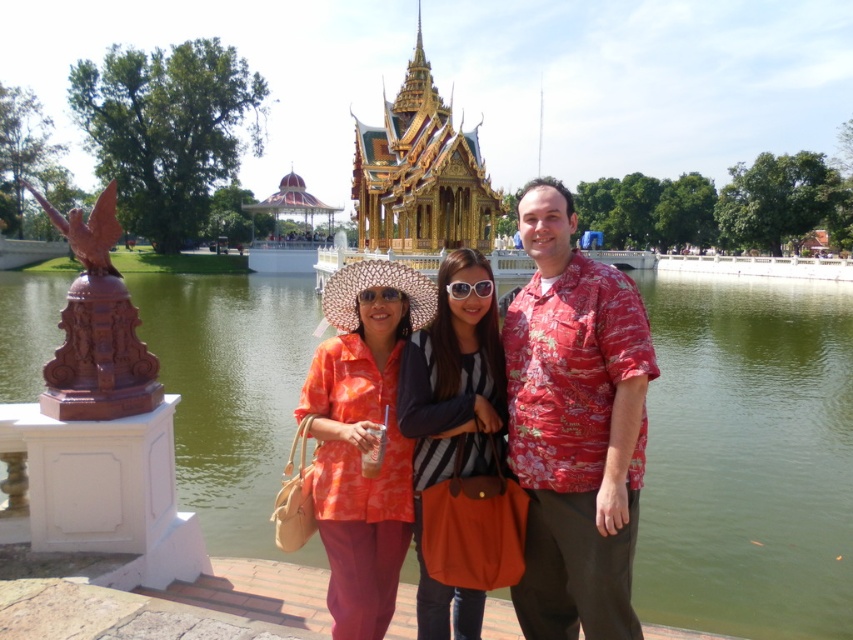
Which is more to the left, floral print shirt at center or matte black goggles at center?

Positioned to the left is matte black goggles at center.

Who is more forward, (601,381) or (384,298)?

Point (601,381)

Image resolution: width=853 pixels, height=640 pixels. I want to click on floral print shirt at center, so click(x=575, y=426).

Is orange printed shirt at center taller than striped fabric shirt at center?

No.

Is point (355, 620) farther from viewer compared to point (463, 637)?

No.

Identify the location of orange printed shirt at center. This screenshot has height=640, width=853. (363, 442).

Is matte orange shirt at center in front of floral print shirt at center?

Yes, matte orange shirt at center is in front of floral print shirt at center.

Is point (614, 572) behind point (548, 564)?

That is False.

Where is `matte orange shirt at center`? Image resolution: width=853 pixels, height=640 pixels. matte orange shirt at center is located at coordinates (575, 426).